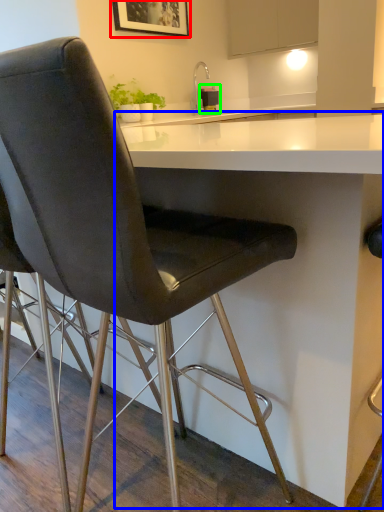
Question: Considering the real-world distances, which object is closest to picture frame (highlighted by a red box)? table (highlighted by a blue box) or appliance (highlighted by a green box).

Choices:
 (A) table
 (B) appliance

Answer: (B)